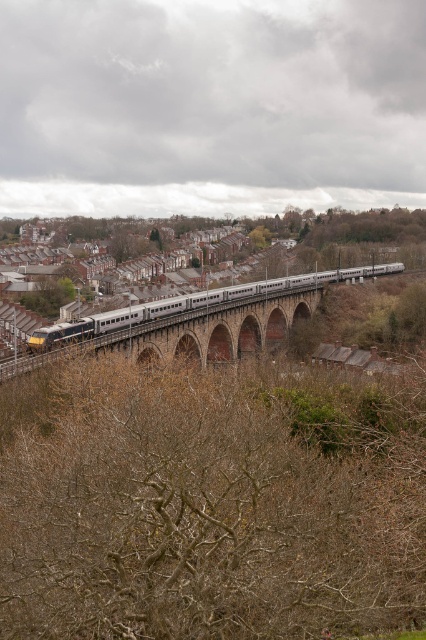
You are a photographer standing at the train station. You want to take a photo of the brown stone arch bridge at center and the green leafy tree at lower left. Which object is closer to the camera?

The green leafy tree at lower left is closer to the camera because the brown stone arch bridge at center is positioned under it.

You are a photographer standing at the origin point of the image. You want to capture the silver metallic train at center in your photo. What are the coordinates where you should aim your camera?

The silver metallic train at center is located at coordinates 0.475 on the x axis and 0.465 on the y axis, so you should aim your camera at those coordinates to capture it.